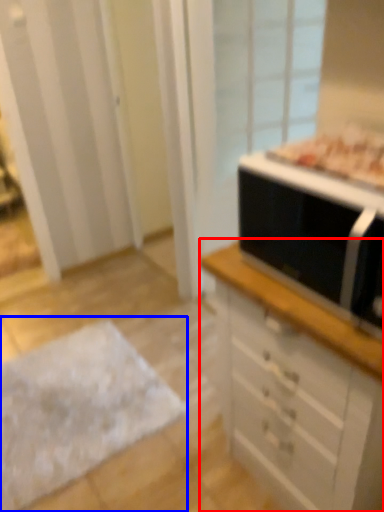
Question: Which point is closer to the camera, chest of drawers (highlighted by a red box) or flat (highlighted by a blue box)?

Choices:
 (A) chest of drawers
 (B) flat

Answer: (A)